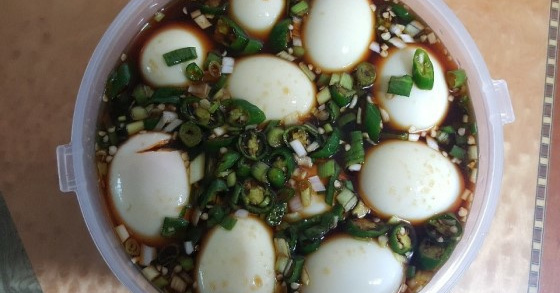
What are the coordinates of `bowl holding soup` in the screenshot? It's located at (497, 96).